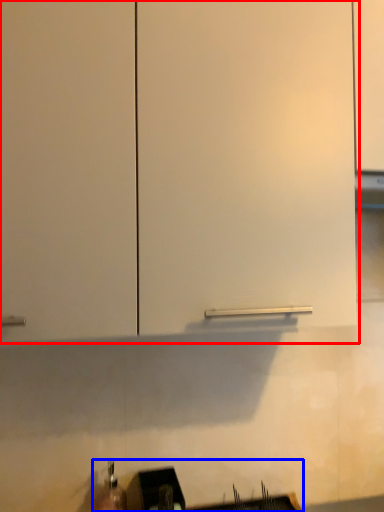
Question: Which point is further to the camera, cabinetry (highlighted by a red box) or sink (highlighted by a blue box)?

Choices:
 (A) cabinetry
 (B) sink

Answer: (B)